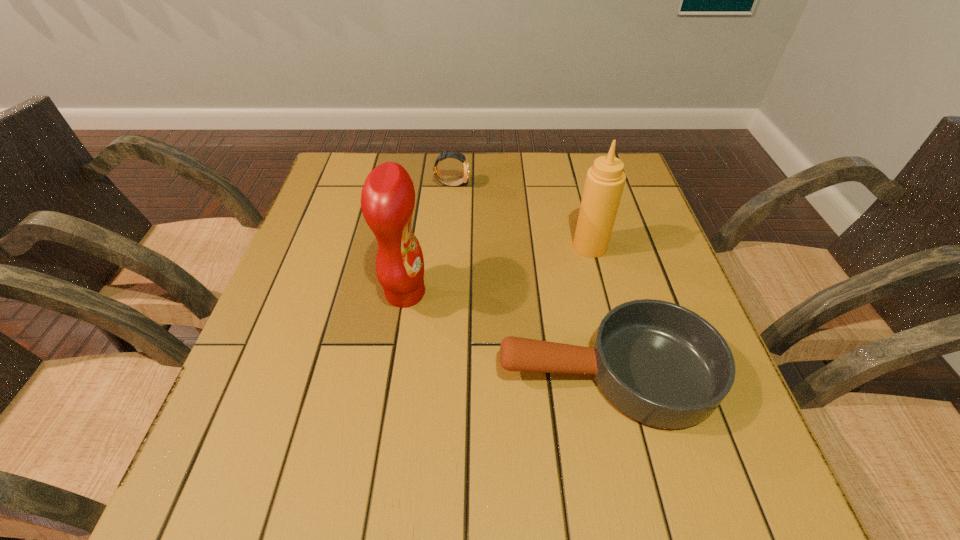
This screenshot has height=540, width=960. Find the location of `vacant region located 0.350m on the handle side of the pan`. vacant region located 0.350m on the handle side of the pan is located at coordinates (312, 373).

In order to click on vacant position located on the handle side of the pan in this screenshot , I will do `click(450, 373)`.

Find the location of a particular element. This screenshot has height=540, width=960. free region located 0.270m on the handle side of the pan is located at coordinates (354, 373).

Locate an element on the screen. This screenshot has width=960, height=540. object that is at the far edge is located at coordinates (459, 156).

This screenshot has height=540, width=960. I want to click on condiment located in the right edge section of the desktop, so click(x=605, y=180).

Where is `pan situated at the right edge`? The height and width of the screenshot is (540, 960). pan situated at the right edge is located at coordinates (661, 364).

Find the location of a particular element. This screenshot has height=540, width=960. free space at the far edge of the desktop is located at coordinates (520, 157).

Locate an element on the screen. Image resolution: width=960 pixels, height=540 pixels. vacant region at the near edge of the desktop is located at coordinates (394, 470).

In the image, there is a desktop. Where is `vacant area at the left edge`? This screenshot has height=540, width=960. vacant area at the left edge is located at coordinates (356, 213).

You are a GUI agent. You are given a task and a screenshot of the screen. Output one action in this format:
    pyautogui.click(x=<x>, y=<y>)
    Task: Click on the vacant area at the near left corner
    The width and height of the screenshot is (960, 540).
    Given the screenshot: What is the action you would take?
    pyautogui.click(x=252, y=491)